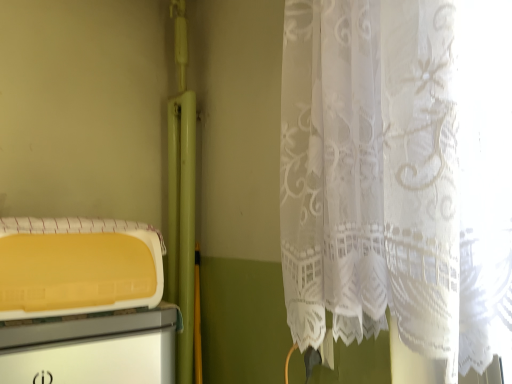
The height and width of the screenshot is (384, 512). Describe the element at coordinates (399, 174) in the screenshot. I see `white lace curtain at right` at that location.

Locate an element on the screen. This screenshot has height=384, width=512. white lace curtain at right is located at coordinates 399,174.

The width and height of the screenshot is (512, 384). Identify the location of white lace curtain at right. 399,174.